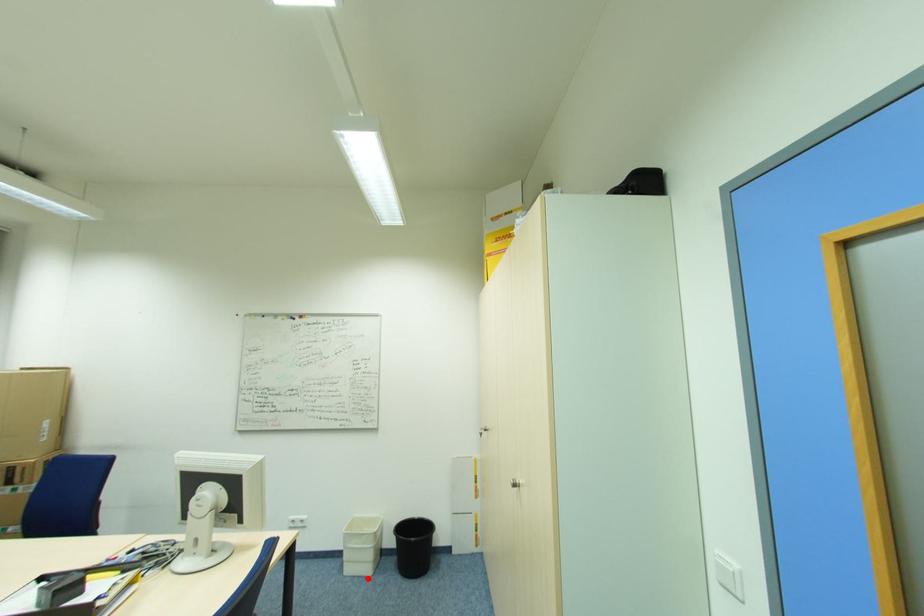
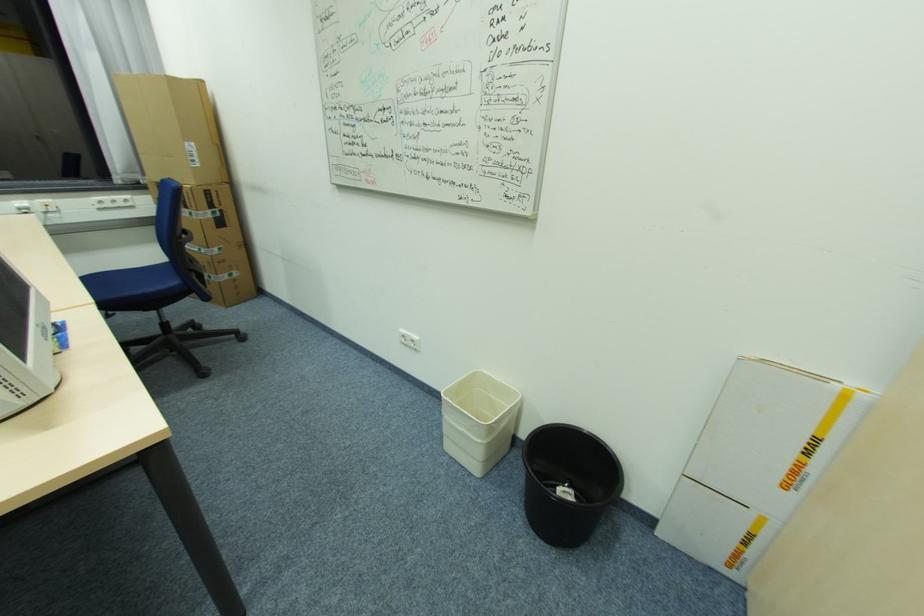
Locate, in the second image, the point that corresponds to the highlighted location in the first image.

(472, 475)